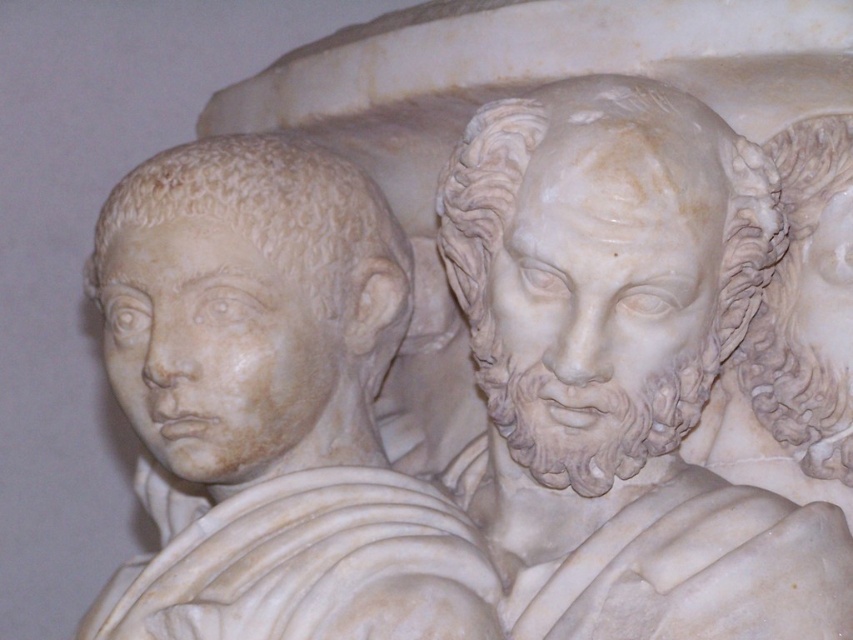
Question: Does white marble head at center appear over white marble head at left?

Choices:
 (A) no
 (B) yes

Answer: (B)

Question: Is white marble head at left positioned at the back of white marble hair at upper right?

Choices:
 (A) yes
 (B) no

Answer: (B)

Question: Does white marble head at left appear on the left side of white marble hair at upper right?

Choices:
 (A) no
 (B) yes

Answer: (B)

Question: Which object is positioned closest to the white marble head at center?

Choices:
 (A) white marble hair at upper right
 (B) white marble head at left

Answer: (A)

Question: Which object is the farthest from the white marble hair at upper right?

Choices:
 (A) white marble head at center
 (B) white marble head at left

Answer: (B)

Question: Which point appears closest to the camera in this image?

Choices:
 (A) (148, 208)
 (B) (807, 157)
 (C) (527, 100)

Answer: (C)